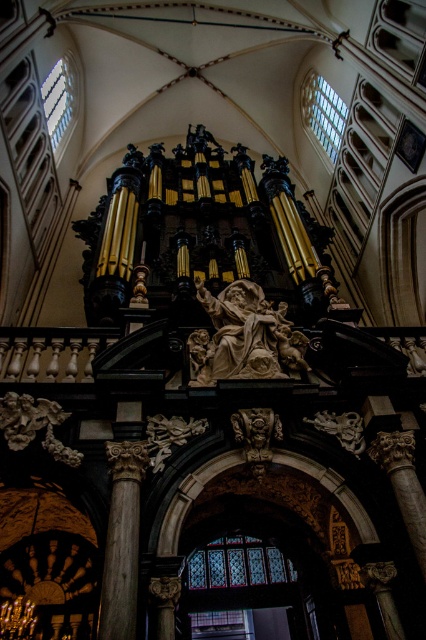
Question: Observing the image, what is the correct spatial positioning of white marble statue at center in reference to wooden column at center?

Choices:
 (A) left
 (B) right

Answer: (B)

Question: Which object is closer to the camera taking this photo?

Choices:
 (A) white marble statue at center
 (B) wooden column at center

Answer: (B)

Question: Can you confirm if white marble statue at center is positioned above wooden column at center?

Choices:
 (A) no
 (B) yes

Answer: (B)

Question: Can you confirm if white marble statue at center is positioned to the left of wooden column at center?

Choices:
 (A) no
 (B) yes

Answer: (A)